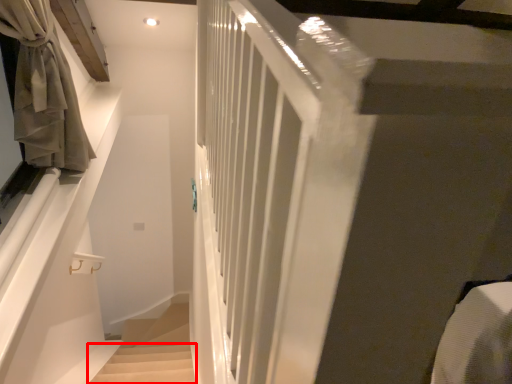
Question: From the image's perspective, considering the relative positions of stairs (annotated by the red box) and curtain in the image provided, where is stairs (annotated by the red box) located with respect to the staircase?

Choices:
 (A) above
 (B) below

Answer: (B)